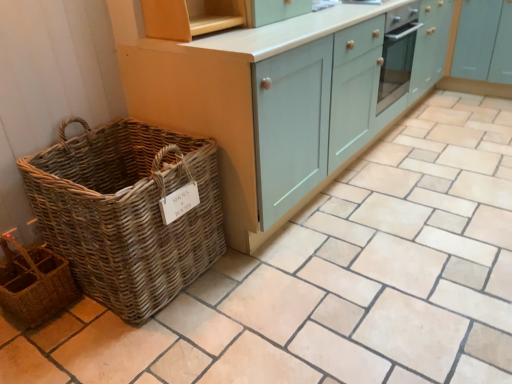
Find the location of `space that is in front of rustic wicker basket at lower left`. space that is in front of rustic wicker basket at lower left is located at coordinates (35, 355).